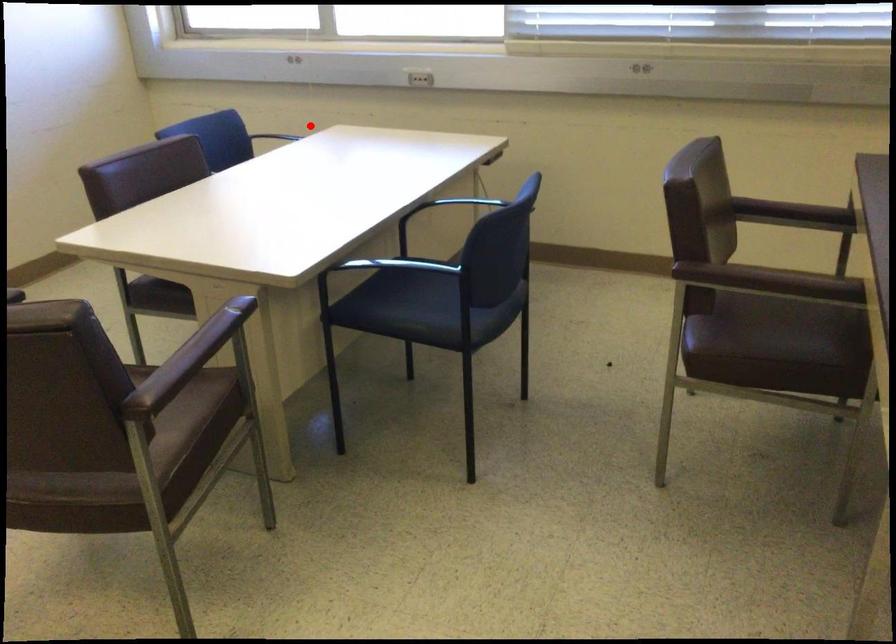
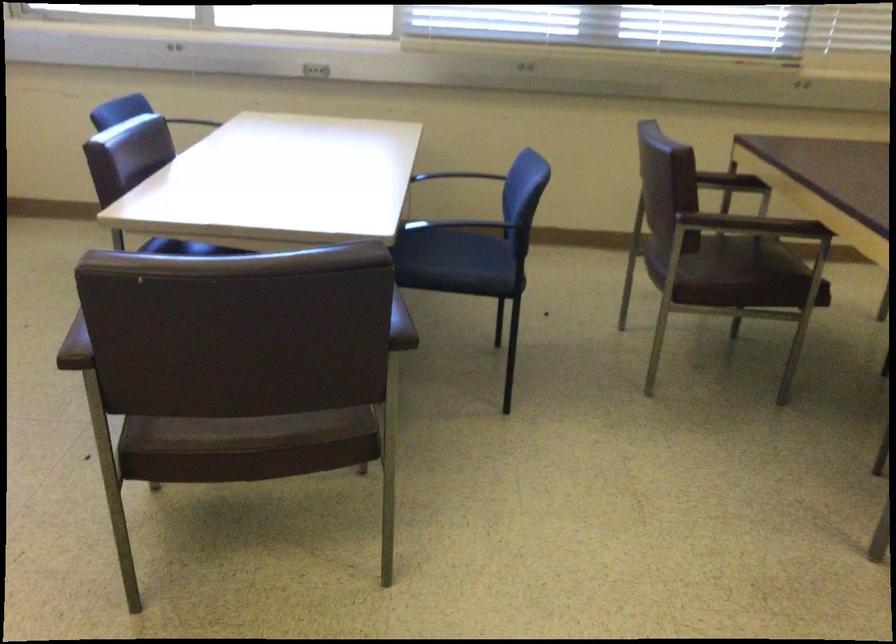
Find the pixel in the second image that matches the highlighted location in the first image.

(202, 120)